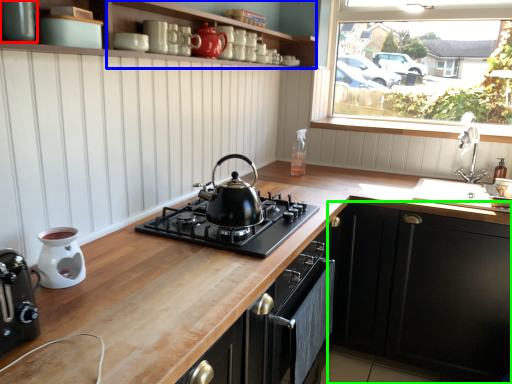
Question: Which object is the closest to the kitchen appliance (highlighted by a red box)? Choose among these: shelf (highlighted by a blue box) or cabinetry (highlighted by a green box).

Choices:
 (A) shelf
 (B) cabinetry

Answer: (A)